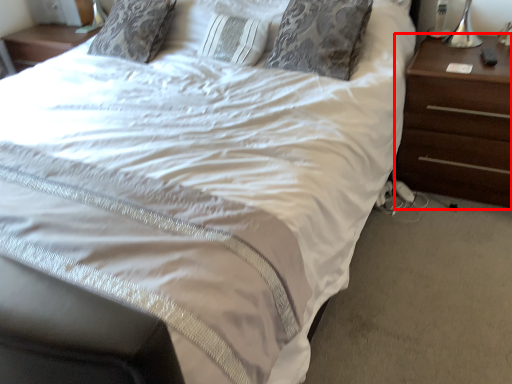
Question: From the image, what is the correct spatial relationship of nightstand (annotated by the red box) in relation to pillow?

Choices:
 (A) left
 (B) right

Answer: (B)